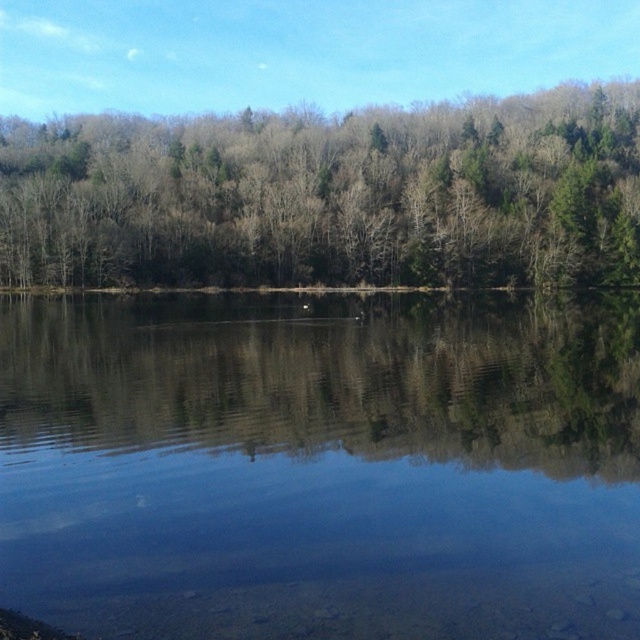
Based on the photo, you are standing on the shore looking at the clear water at center and the green matte trees at center. Which object appears taller from your perspective?

The green matte trees at center appear taller than the clear water at center because the clear water at center has a lesser height compared to the green matte trees at center.

You are standing at the edge of the water and see the clear water at center and the green matte trees at center. Which object is closer to you?

The clear water at center is closer to you than the green matte trees at center because it is positioned below them.

Based on the scene description, which object takes up more space in the image? Please consider the clear water at center and the green matte trees at center in your answer.

The green matte trees at center occupy more space than the clear water at center in the image.